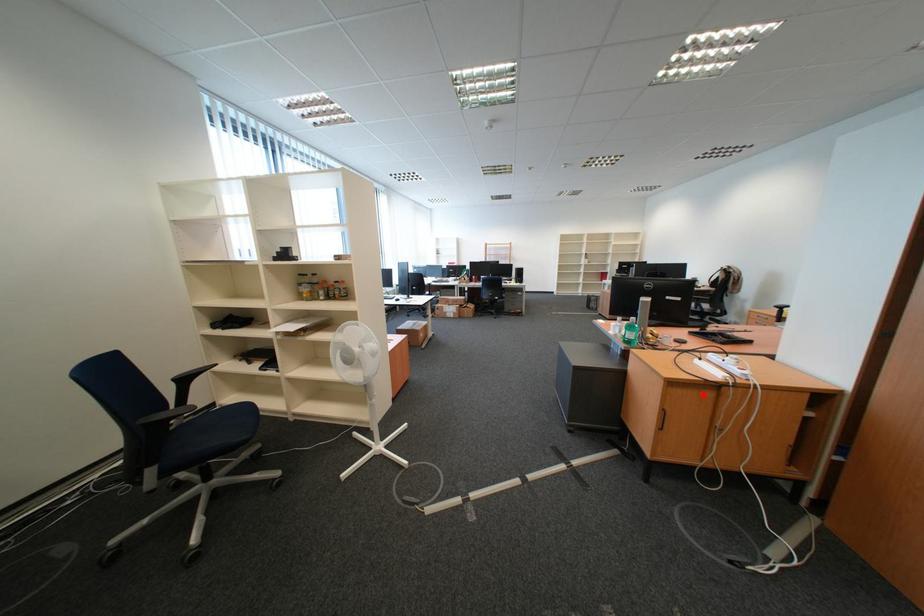
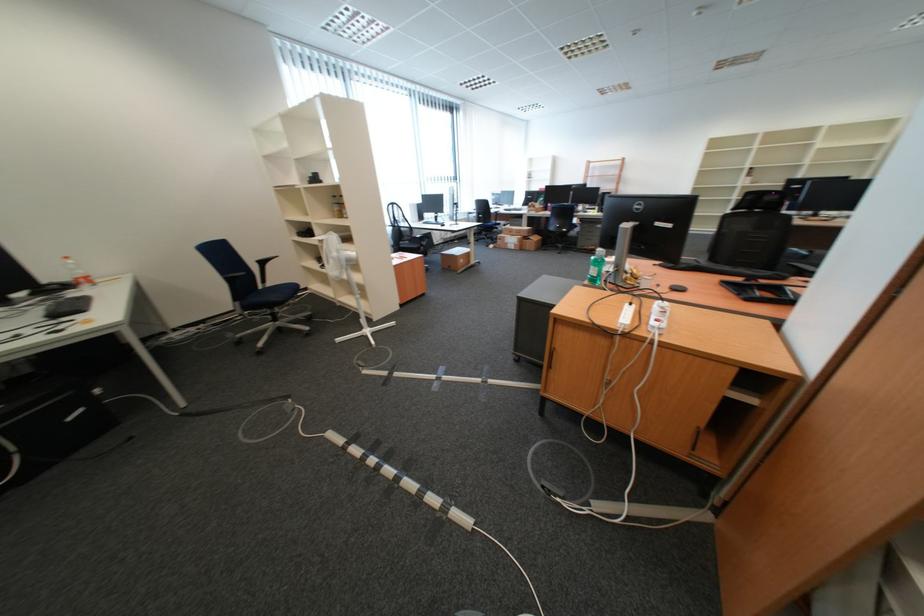
Question: I am providing you with two images of the same scene from different viewpoints. In image1, a red point is highlighted. Considering the same 3D point in image2, which of the following is correct?

Choices:
 (A) It is closer
 (B) It is farther

Answer: (A)